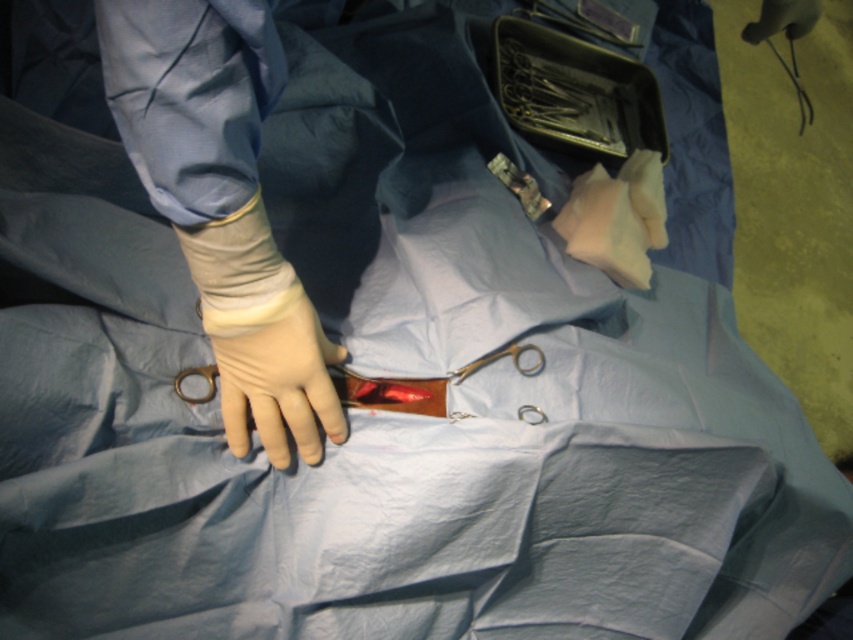
Question: Where is metallic silver surgical instruments at upper right located in relation to rubber glove at center in the image?

Choices:
 (A) below
 (B) above

Answer: (B)

Question: Which object appears closest to the camera in this image?

Choices:
 (A) metallic silver surgical instruments at upper right
 (B) rubber glove at center
 (C) beige rubber glove at left

Answer: (C)

Question: Which point is closer to the camera taking this photo?

Choices:
 (A) (311, 404)
 (B) (572, 132)
 (C) (323, 422)

Answer: (A)

Question: Observing the image, what is the correct spatial positioning of metallic silver surgical instruments at upper right in reference to rubber glove at center?

Choices:
 (A) above
 (B) below

Answer: (A)

Question: Can you confirm if metallic silver surgical instruments at upper right is thinner than rubber glove at center?

Choices:
 (A) yes
 (B) no

Answer: (B)

Question: Which point is farther to the camera?

Choices:
 (A) rubber glove at center
 (B) beige rubber glove at left
 (C) metallic silver surgical instruments at upper right

Answer: (C)